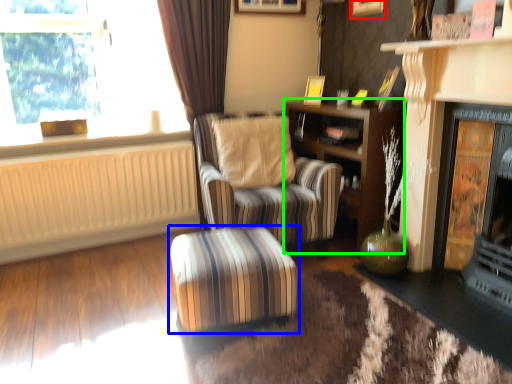
Question: Which object is positioned farthest from picture frame (highlighted by a red box)? Select from table (highlighted by a blue box) and shelf (highlighted by a green box).

Choices:
 (A) table
 (B) shelf

Answer: (A)